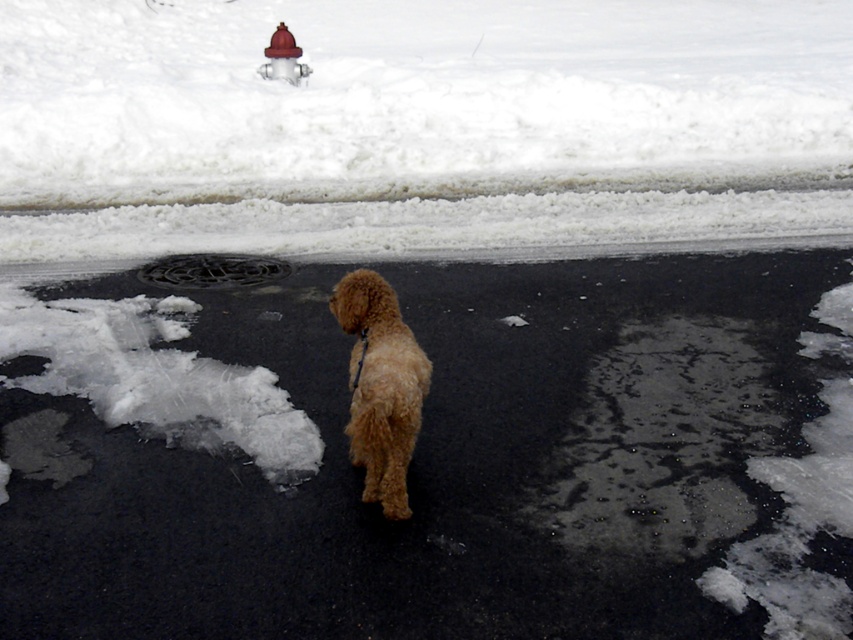
Question: Which point is farther to the camera?

Choices:
 (A) fuzzy golden dog at center
 (B) black rubber manhole cover at center
 (C) brushed metal fire hydrant at upper center
 (D) brown furry dog at center

Answer: (C)

Question: Where is brown furry dog at center located in relation to black rubber manhole cover at center in the image?

Choices:
 (A) left
 (B) right

Answer: (B)

Question: Is white fluffy snow at upper center closer to camera compared to fuzzy golden dog at center?

Choices:
 (A) no
 (B) yes

Answer: (A)

Question: Which point is closer to the camera?

Choices:
 (A) brown furry dog at center
 (B) white fluffy snow at upper center
 (C) black rubber manhole cover at center
 (D) brushed metal fire hydrant at upper center

Answer: (A)

Question: Can you confirm if brown furry dog at center is positioned to the right of black rubber manhole cover at center?

Choices:
 (A) yes
 (B) no

Answer: (A)

Question: Which is nearer to the brown furry dog at center?

Choices:
 (A) fuzzy golden dog at center
 (B) brushed metal fire hydrant at upper center

Answer: (A)